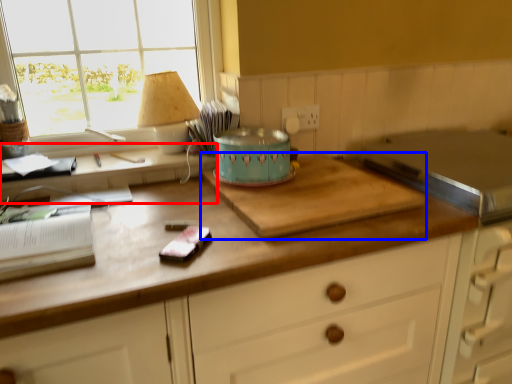
Question: Which of the following is the closest to the observer, computer desk (highlighted by a red box) or cutting board (highlighted by a blue box)?

Choices:
 (A) computer desk
 (B) cutting board

Answer: (B)